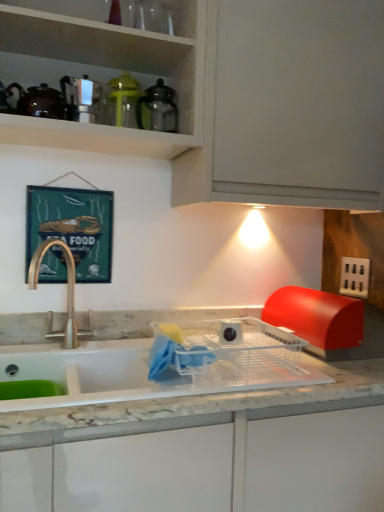
Question: Should I look upward or downward to see black plastic electric outlet at right?

Choices:
 (A) down
 (B) up

Answer: (A)

Question: Can you confirm if black plastic electric outlet at right is wider than transparent glass pitcher at upper center, which is the 1th appliance from right to left?

Choices:
 (A) yes
 (B) no

Answer: (B)

Question: Considering the relative sizes of black plastic electric outlet at right and transparent glass pitcher at upper center, which is the 1th appliance from right to left, in the image provided, is black plastic electric outlet at right shorter than transparent glass pitcher at upper center, which is the 1th appliance from right to left,?

Choices:
 (A) no
 (B) yes

Answer: (B)

Question: Can you confirm if black plastic electric outlet at right is taller than transparent glass pitcher at upper center, which is the 1th appliance from right to left?

Choices:
 (A) no
 (B) yes

Answer: (A)

Question: Is black plastic electric outlet at right behind transparent glass pitcher at upper center, the third appliance positioned from the left?

Choices:
 (A) no
 (B) yes

Answer: (B)

Question: Does black plastic electric outlet at right touch transparent glass pitcher at upper center, the third appliance positioned from the left?

Choices:
 (A) no
 (B) yes

Answer: (A)

Question: Does black plastic electric outlet at right appear on the left side of transparent glass pitcher at upper center, which is the 1th appliance from right to left?

Choices:
 (A) yes
 (B) no

Answer: (B)

Question: Is satin nickel soap dispenser at upper left, the 1th appliance when ordered from left to right, outside black plastic electric outlet at right?

Choices:
 (A) no
 (B) yes

Answer: (B)

Question: Does satin nickel soap dispenser at upper left, the 3th appliance in the right-to-left sequence, contain black plastic electric outlet at right?

Choices:
 (A) no
 (B) yes

Answer: (A)

Question: Is satin nickel soap dispenser at upper left, the 1th appliance when ordered from left to right, oriented away from black plastic electric outlet at right?

Choices:
 (A) yes
 (B) no

Answer: (B)

Question: Does satin nickel soap dispenser at upper left, the 3th appliance in the right-to-left sequence, come in front of black plastic electric outlet at right?

Choices:
 (A) yes
 (B) no

Answer: (A)

Question: From a real-world perspective, is satin nickel soap dispenser at upper left, the 3th appliance in the right-to-left sequence, on top of black plastic electric outlet at right?

Choices:
 (A) yes
 (B) no

Answer: (A)

Question: Are satin nickel soap dispenser at upper left, the 3th appliance in the right-to-left sequence, and black plastic electric outlet at right beside each other?

Choices:
 (A) yes
 (B) no

Answer: (B)

Question: Is black plastic electric outlet at right in contact with satin nickel soap dispenser at upper left, the 1th appliance when ordered from left to right?

Choices:
 (A) no
 (B) yes

Answer: (A)